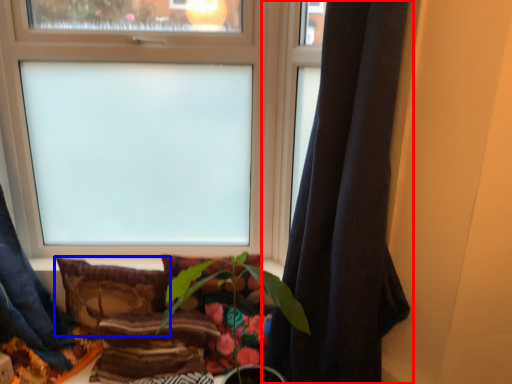
Question: Among these objects, which one is farthest to the camera, curtain (highlighted by a red box) or pillow (highlighted by a blue box)?

Choices:
 (A) curtain
 (B) pillow

Answer: (B)